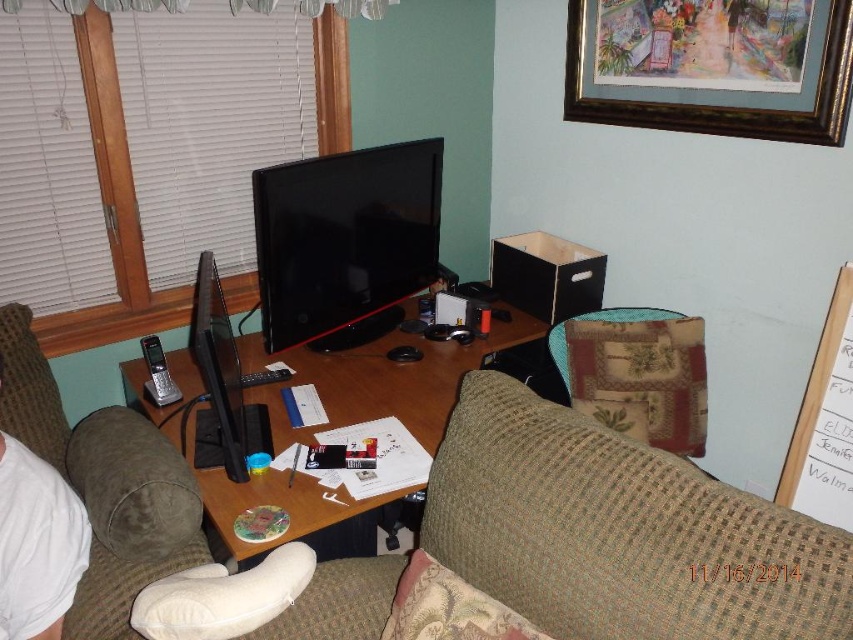
What do you see at coordinates (381, 378) in the screenshot? I see `black glossy computer desk at center` at bounding box center [381, 378].

Can you confirm if black glossy computer desk at center is bigger than patchwork fabric armchair at center?

Yes.

What do you see at coordinates (381, 378) in the screenshot? The width and height of the screenshot is (853, 640). I see `black glossy computer desk at center` at bounding box center [381, 378].

Locate an element on the screen. The width and height of the screenshot is (853, 640). black glossy computer desk at center is located at coordinates (381, 378).

Based on the photo, between gold-framed artwork at upper right and black glossy computer desk at center, which one has less height?

Standing shorter between the two is gold-framed artwork at upper right.

Consider the image. Between gold-framed artwork at upper right and black glossy computer desk at center, which one appears on the right side from the viewer's perspective?

gold-framed artwork at upper right

Locate an element on the screen. gold-framed artwork at upper right is located at coordinates (712, 67).

Does point (787, 532) lie in front of point (287, 276)?

Yes.

You are a GUI agent. You are given a task and a screenshot of the screen. Output one action in this format:
    pyautogui.click(x=<x>, y=<y>)
    Task: Click on the green fabric swivel chair at center
    This screenshot has height=640, width=853.
    Given the screenshot: What is the action you would take?
    pyautogui.click(x=619, y=532)

Where is `green fabric swivel chair at center`? green fabric swivel chair at center is located at coordinates tap(619, 532).